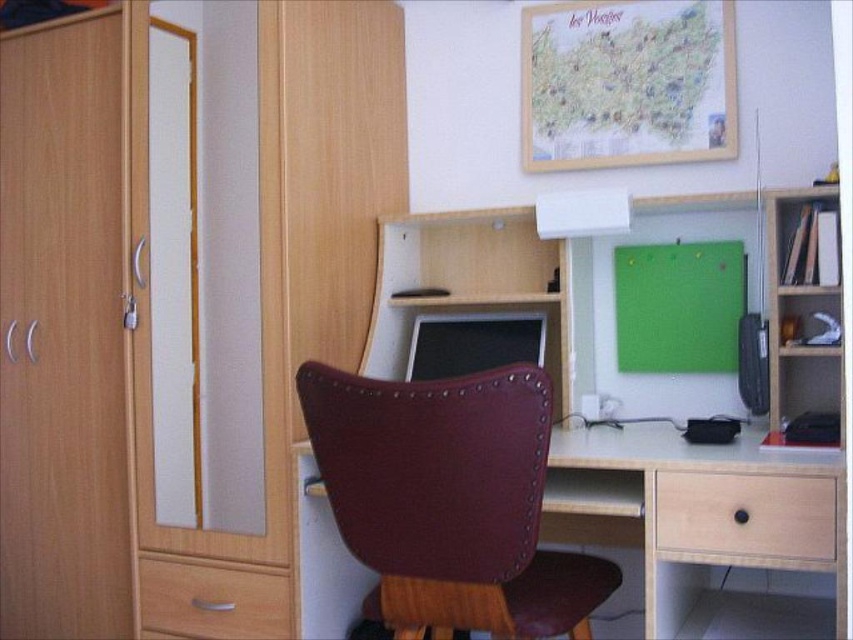
Question: Does leather-like burgundy swivel chair at center appear on the left side of light brown wood drawer at lower left?

Choices:
 (A) no
 (B) yes

Answer: (A)

Question: Among these objects, which one is farthest from the camera?

Choices:
 (A) leather-like burgundy swivel chair at center
 (B) light brown wood drawer at lower right

Answer: (B)

Question: Does light brown wood drawer at lower right appear under light brown wood drawer at lower left?

Choices:
 (A) no
 (B) yes

Answer: (A)

Question: Which point appears closest to the camera in this image?

Choices:
 (A) (360, 544)
 (B) (488, 330)
 (C) (169, 612)
 (D) (834, 506)

Answer: (D)

Question: Can you confirm if light brown wood drawer at lower left is positioned above matte black monitor at center?

Choices:
 (A) yes
 (B) no

Answer: (B)

Question: Which of the following is the closest to the observer?

Choices:
 (A) [422, 340]
 (B) [714, 493]
 (C) [173, 561]

Answer: (B)